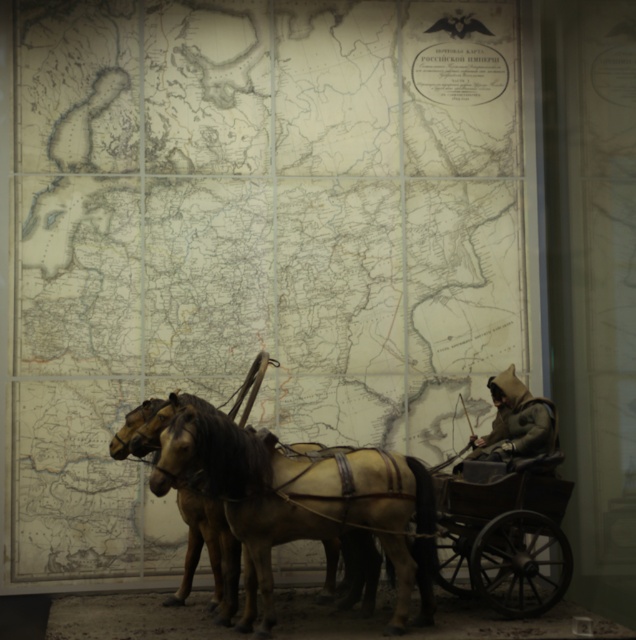
Consider the image. Does light brown leather horse cart at center lie behind brown leather horse at center?

Yes.

I want to click on light brown leather horse cart at center, so click(x=265, y=477).

Identify the location of light brown leather horse cart at center. (265, 477).

Where is `light brown leather horse cart at center`? The image size is (636, 640). light brown leather horse cart at center is located at coordinates (265, 477).

Can you confirm if light brown leather horse cart at center is thinner than green felt hat at right?

In fact, light brown leather horse cart at center might be wider than green felt hat at right.

Which is in front, point (541, 417) or point (452, 467)?

Point (541, 417)

What are the coordinates of `light brown leather horse cart at center` in the screenshot? It's located at (265, 477).

Can you confirm if brown leather horse at center is shorter than green felt hat at right?

No, brown leather horse at center is not shorter than green felt hat at right.

Find the location of `brown leather horse at center`. brown leather horse at center is located at coordinates (301, 502).